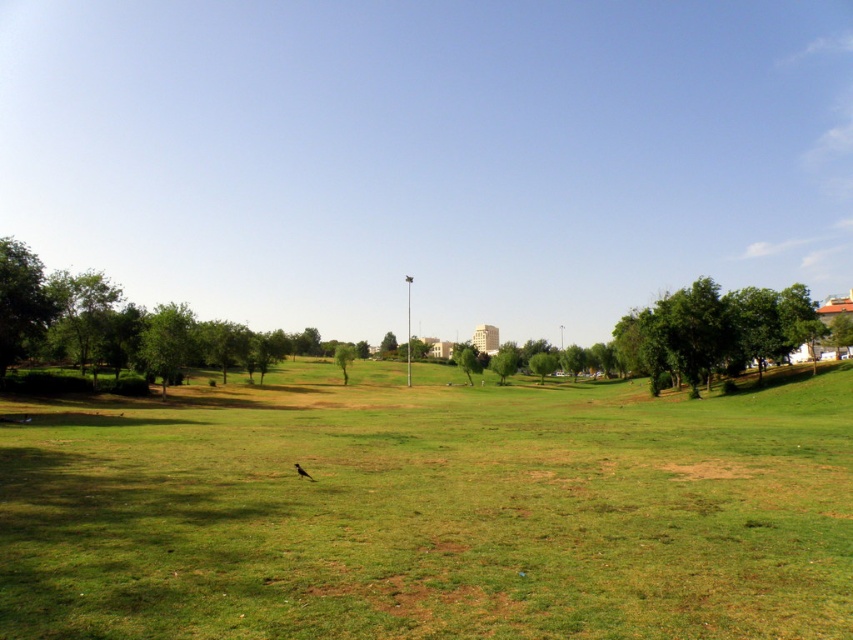
Is point (15, 316) closer to camera compared to point (352, 358)?

Yes, it is.

Is point (0, 378) more distant than point (352, 346)?

No, (0, 378) is in front of (352, 346).

Locate an element on the screen. The width and height of the screenshot is (853, 640). green leafy tree at left is located at coordinates (20, 301).

In the scene shown: Who is more distant from viewer, (x=1, y=289) or (x=305, y=472)?

The point (x=1, y=289) is more distant.

Does green leafy tree at left appear on the right side of brown feathered bird at center?

Incorrect, green leafy tree at left is not on the right side of brown feathered bird at center.

Which is in front, point (33, 326) or point (294, 465)?

Point (294, 465) is in front.

Where is `green leafy tree at left`? This screenshot has width=853, height=640. green leafy tree at left is located at coordinates (20, 301).

Who is positioned more to the right, green grass at center or green leafy tree at left?

green grass at center is more to the right.

Is green grass at center bigger than green leafy tree at left?

Correct, green grass at center is larger in size than green leafy tree at left.

Is point (451, 477) farther from camera compared to point (26, 310)?

That is False.

Where is `green grass at center`? This screenshot has height=640, width=853. green grass at center is located at coordinates (428, 509).